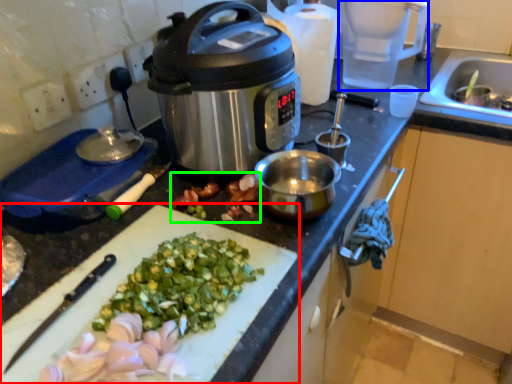
Question: Estimate the real-world distances between objects in this image. Which object is farther from cutting board (highlighted by a red box), blender (highlighted by a blue box) or produce (highlighted by a green box)?

Choices:
 (A) blender
 (B) produce

Answer: (A)